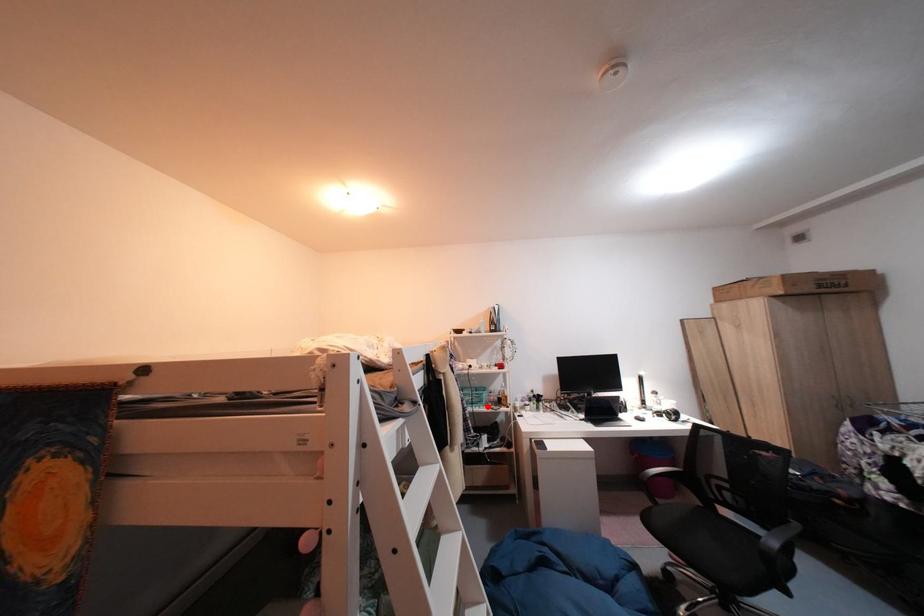
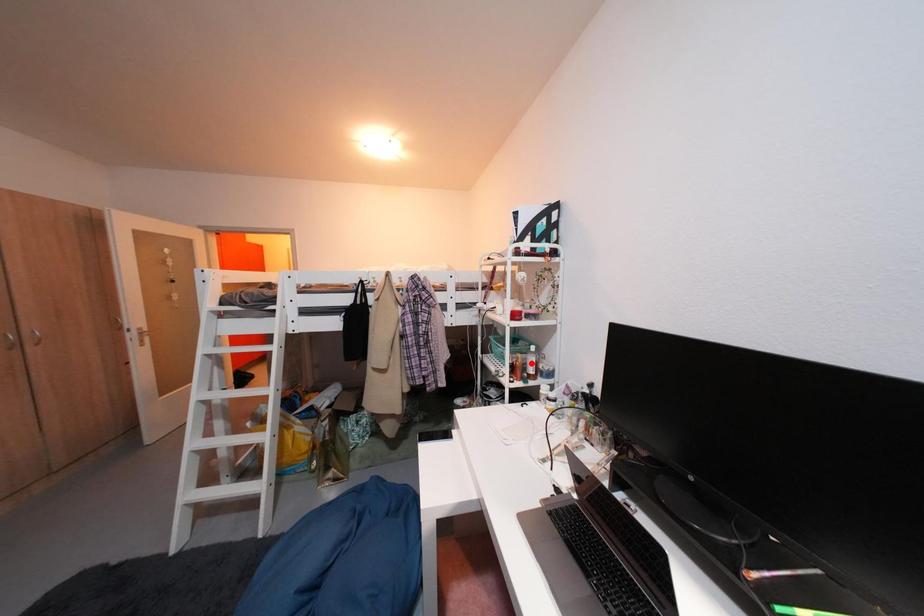
I am providing you with two images of the same scene from different viewpoints. A red point is marked on the first image and another point is marked on the second image. Does the point marked in image1 correspond to the same location as the one in image2?

No